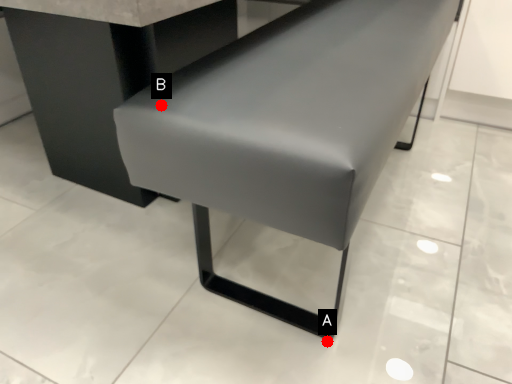
Question: Two points are circled on the image, labeled by A and B beside each circle. Which point is farther to the camera?

Choices:
 (A) A is further
 (B) B is further

Answer: (A)